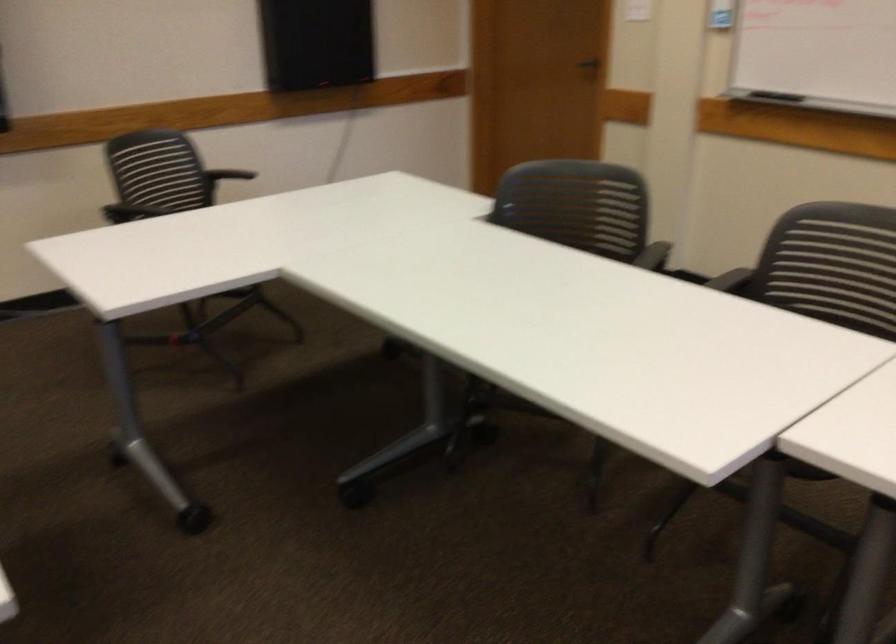
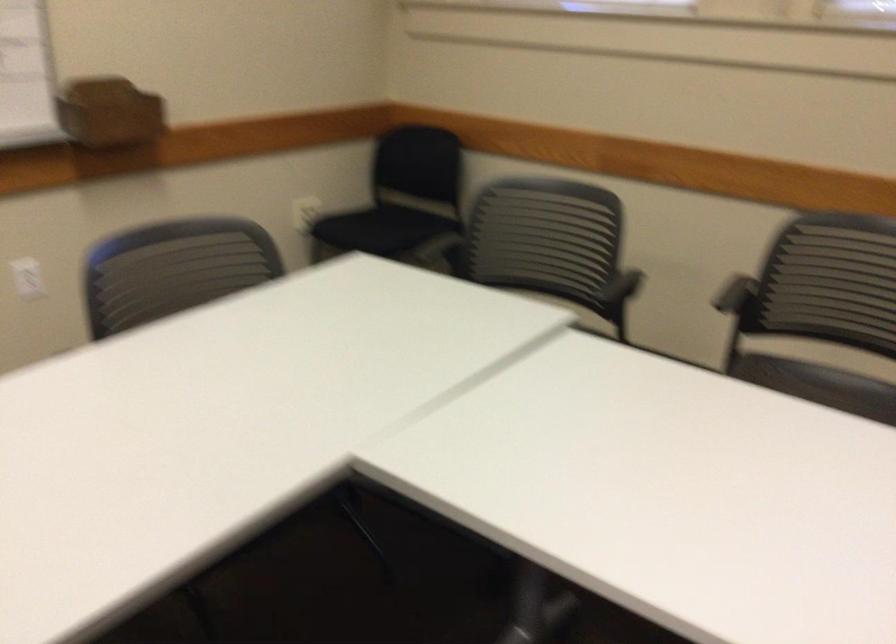
The images are taken continuously from a first-person perspective. In which direction is your viewpoint rotating?

The camera's rotation is toward right-down.